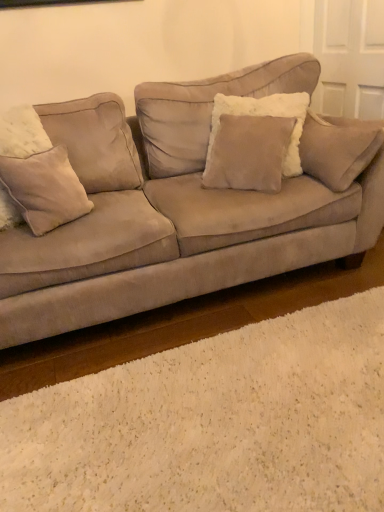
Question: Considering the relative sizes of suede couch at center and fuzzy beige pillow at left, placed as the 2th pillow when sorted from right to left, in the image provided, is suede couch at center thinner than fuzzy beige pillow at left, placed as the 2th pillow when sorted from right to left,?

Choices:
 (A) yes
 (B) no

Answer: (B)

Question: Does suede couch at center have a smaller size compared to fuzzy beige pillow at left, the first pillow in the left-to-right sequence?

Choices:
 (A) yes
 (B) no

Answer: (B)

Question: Is suede couch at center not within fuzzy beige pillow at left, the first pillow in the left-to-right sequence?

Choices:
 (A) yes
 (B) no

Answer: (A)

Question: Is suede couch at center far from fuzzy beige pillow at left, placed as the 2th pillow when sorted from right to left?

Choices:
 (A) yes
 (B) no

Answer: (B)

Question: From the image's perspective, would you say suede couch at center is shown under fuzzy beige pillow at left, placed as the 2th pillow when sorted from right to left?

Choices:
 (A) yes
 (B) no

Answer: (B)

Question: From a real-world perspective, is suede/velvet pillow at center, which appears as the 1th pillow when viewed from the right, positioned above or below fuzzy beige pillow at left, placed as the 2th pillow when sorted from right to left?

Choices:
 (A) above
 (B) below

Answer: (A)

Question: Would you say suede/velvet pillow at center, which appears as the 1th pillow when viewed from the right, is inside or outside fuzzy beige pillow at left, placed as the 2th pillow when sorted from right to left?

Choices:
 (A) outside
 (B) inside

Answer: (A)

Question: Would you say suede/velvet pillow at center, positioned as the second pillow in left-to-right order, is to the left or to the right of fuzzy beige pillow at left, the first pillow in the left-to-right sequence, in the picture?

Choices:
 (A) right
 (B) left

Answer: (A)

Question: From the image's perspective, is suede/velvet pillow at center, which appears as the 1th pillow when viewed from the right, located above or below fuzzy beige pillow at left, placed as the 2th pillow when sorted from right to left?

Choices:
 (A) above
 (B) below

Answer: (A)

Question: From the image's perspective, is fuzzy beige pillow at left, placed as the 2th pillow when sorted from right to left, positioned above or below suede/velvet pillow at center, which appears as the 1th pillow when viewed from the right?

Choices:
 (A) below
 (B) above

Answer: (A)

Question: In the image, is fuzzy beige pillow at left, the first pillow in the left-to-right sequence, on the left side or the right side of suede/velvet pillow at center, which appears as the 1th pillow when viewed from the right?

Choices:
 (A) right
 (B) left

Answer: (B)

Question: Is fuzzy beige pillow at left, the first pillow in the left-to-right sequence, in front of or behind suede/velvet pillow at center, positioned as the second pillow in left-to-right order, in the image?

Choices:
 (A) front
 (B) behind

Answer: (A)

Question: In terms of height, does fuzzy beige pillow at left, the first pillow in the left-to-right sequence, look taller or shorter compared to suede/velvet pillow at center, positioned as the second pillow in left-to-right order?

Choices:
 (A) tall
 (B) short

Answer: (B)

Question: Considering the positions of suede couch at center and fuzzy beige pillow at left, placed as the 2th pillow when sorted from right to left, in the image, is suede couch at center wider or thinner than fuzzy beige pillow at left, placed as the 2th pillow when sorted from right to left,?

Choices:
 (A) wide
 (B) thin

Answer: (A)

Question: From a real-world perspective, is suede couch at center positioned above or below fuzzy beige pillow at left, the first pillow in the left-to-right sequence?

Choices:
 (A) below
 (B) above

Answer: (A)